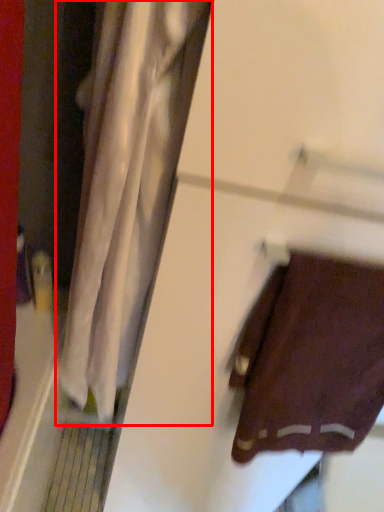
Question: Where is curtain (annotated by the red box) located in relation to towel in the image?

Choices:
 (A) right
 (B) left

Answer: (B)